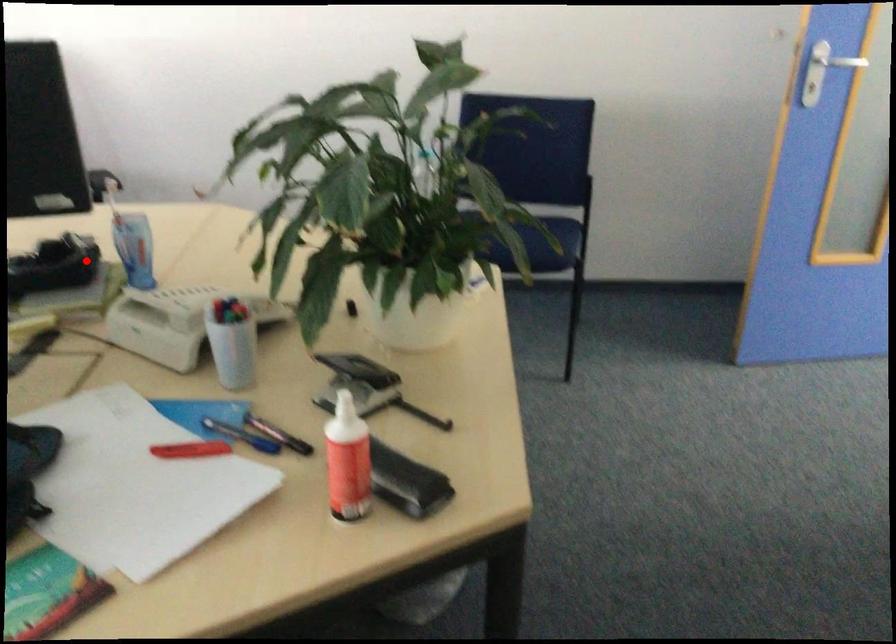
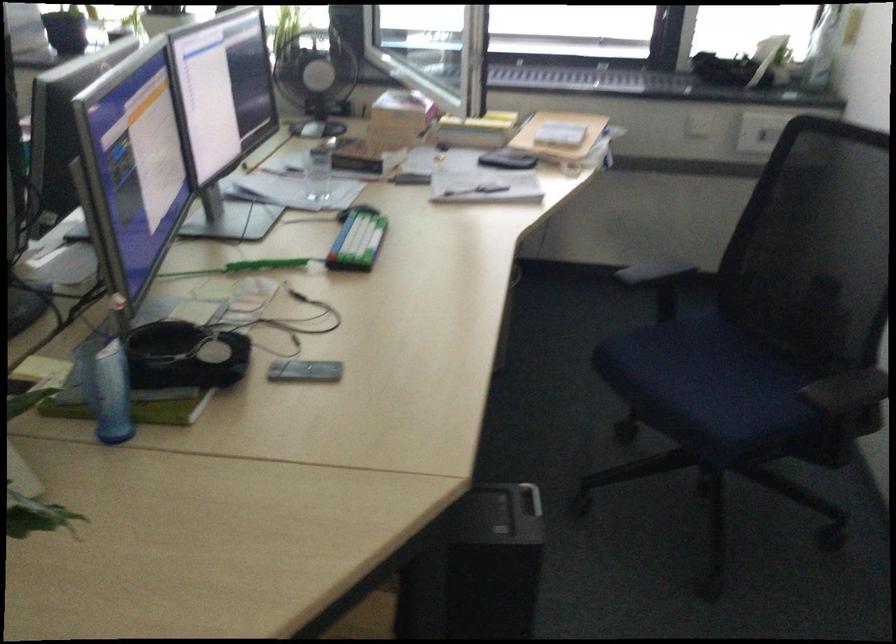
Question: I am providing you with two images of the same scene from different viewpoints. In image1, a red point is highlighted. Considering the same 3D point in image2, which of the following is correct?

Choices:
 (A) It is closer
 (B) It is farther

Answer: (A)